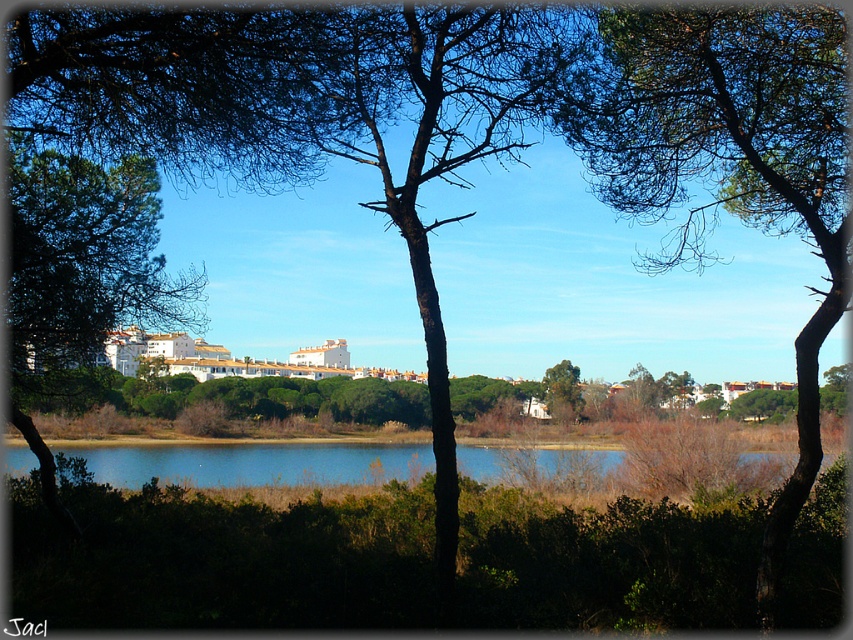
You are an arborist inspecting two trees in the center of the scene. The green rough bark tree at center and the green matte tree at center. Which tree has a wider trunk?

The green rough bark tree at center has a larger width than the green matte tree at center, so the green rough bark tree at center has a wider trunk.

You are a landscape architect designing a garden pathway between the green matte tree at left and the green matte tree at center. Which tree has a wider trunk to consider for spacing?

The green matte tree at left has a wider trunk than the green matte tree at center, so you should consider its width when planning the spacing between them.

You are a landscape architect designing a new garden. You need to place a decorative stone path between the blue water at center and the green matte tree at center. Which object should the path be closer to if you want the path to be wider on the side with the larger width?

The blue water at center has a larger width than the green matte tree at center. Therefore, the path should be closer to the blue water at center to accommodate the wider side.